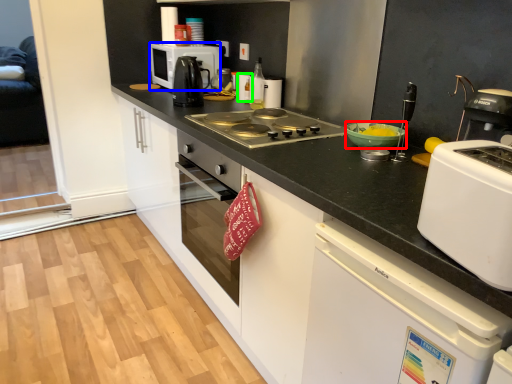
Question: Considering the real-world distances, which object is closest to bowl (highlighted by a red box)? kitchen appliance (highlighted by a blue box) or kitchen appliance (highlighted by a green box).

Choices:
 (A) kitchen appliance
 (B) kitchen appliance

Answer: (B)